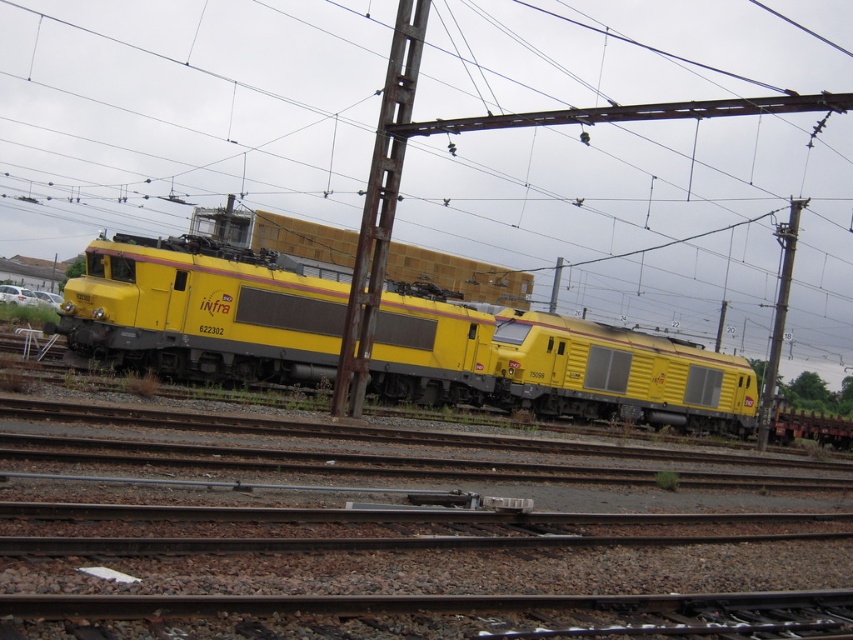
Question: Estimate the real-world distances between objects in this image. Which object is farther from the yellow matte train at center?

Choices:
 (A) rusty metal pole at center
 (B) yellow matte train car at center
 (C) metallic pole at right

Answer: (C)

Question: Based on their relative distances, which object is farther from the metallic pole at right?

Choices:
 (A) yellow matte train car at center
 (B) yellow matte train at center
 (C) rusty metal pole at center

Answer: (C)

Question: Can you confirm if rusty metal pole at center is smaller than metallic pole at right?

Choices:
 (A) yes
 (B) no

Answer: (A)

Question: Is yellow matte train at center above yellow matte train car at center?

Choices:
 (A) yes
 (B) no

Answer: (A)

Question: In this image, where is yellow matte train at center located relative to yellow matte train car at center?

Choices:
 (A) left
 (B) right

Answer: (A)

Question: Which object is the farthest from the yellow matte train at center?

Choices:
 (A) rusty metal pole at center
 (B) yellow matte train car at center
 (C) metallic pole at right

Answer: (C)